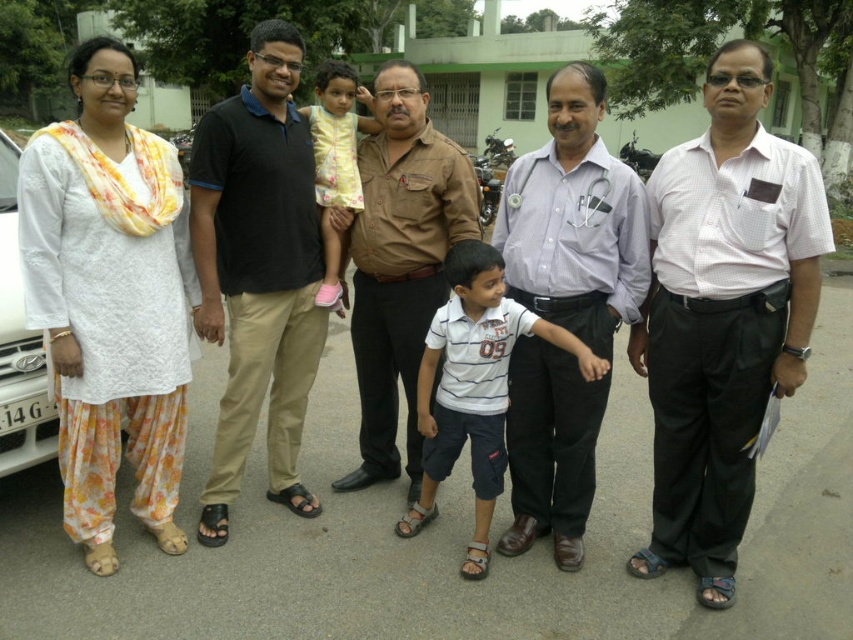
Between point (698, 284) and point (334, 192), which one is positioned in front?

Point (698, 284)

Is point (680, 328) farther from camera compared to point (315, 140)?

No.

In order to click on white checkered shirt at center in this screenshot , I will do `click(723, 316)`.

Is white cotton kurta at left smaller than white glossy car at left?

No, white cotton kurta at left is not smaller than white glossy car at left.

Does white cotton kurta at left appear on the right side of white glossy car at left?

Correct, you'll find white cotton kurta at left to the right of white glossy car at left.

Find the location of a particular element. The image size is (853, 640). white cotton kurta at left is located at coordinates (109, 300).

Is white checkered shirt at center smaller than white glossy car at left?

No.

Does white checkered shirt at center lie in front of white glossy car at left?

Yes, it is in front of white glossy car at left.

Who is more distant from viewer, (654, 522) or (41, 448)?

The point (41, 448) is more distant.

Find the location of `white checkered shirt at center`. white checkered shirt at center is located at coordinates (723, 316).